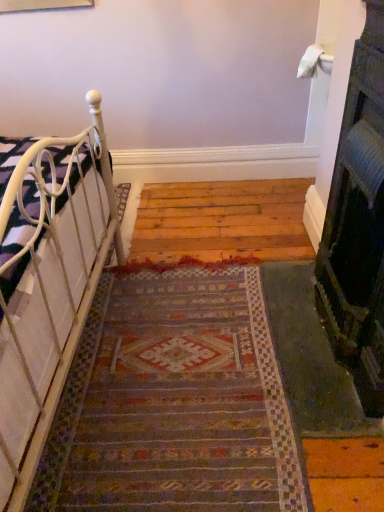
At what (x,y) coordinates should I click in order to perform the action: click on white metal bed at left. Please return your answer as a coordinate pair (x, y). The height and width of the screenshot is (512, 384). Looking at the image, I should click on (61, 271).

Where is `multicolored woven rug at center`? Image resolution: width=384 pixels, height=512 pixels. multicolored woven rug at center is located at coordinates pos(173,402).

Describe the element at coordinates (173, 402) in the screenshot. I see `multicolored woven rug at center` at that location.

The height and width of the screenshot is (512, 384). Identify the location of white metal bed at left. (61, 271).

From the image's perspective, which is below, white metal bed at left or multicolored woven rug at center?

multicolored woven rug at center, from the image's perspective.

Does white metal bed at left have a larger size compared to multicolored woven rug at center?

Indeed, white metal bed at left has a larger size compared to multicolored woven rug at center.

Considering the positions of objects white metal bed at left and multicolored woven rug at center in the image provided, who is more to the right, white metal bed at left or multicolored woven rug at center?

Positioned to the right is multicolored woven rug at center.

Measure the distance from white metal bed at left to multicolored woven rug at center.

white metal bed at left and multicolored woven rug at center are 16.73 inches apart.

Is black textured fireplace at right not inside multicolored woven rug at center?

Yes, black textured fireplace at right is outside of multicolored woven rug at center.

From a real-world perspective, which is physically above, black textured fireplace at right or multicolored woven rug at center?

black textured fireplace at right is physically above.

Would you consider black textured fireplace at right to be distant from multicolored woven rug at center?

No, black textured fireplace at right is not far away from multicolored woven rug at center.

Looking at this image, is black textured fireplace at right looking in the opposite direction of multicolored woven rug at center?

No.

Based on the photo, is multicolored woven rug at center far from black textured fireplace at right?

multicolored woven rug at center is actually quite close to black textured fireplace at right.

Choose the correct answer: Is multicolored woven rug at center inside black textured fireplace at right or outside it?

multicolored woven rug at center is outside black textured fireplace at right.

From a real-world perspective, who is located lower, multicolored woven rug at center or black textured fireplace at right?

From a 3D spatial view, multicolored woven rug at center is below.

Locate an element on the screen. The height and width of the screenshot is (512, 384). fireplace in front of the white metal bed at left is located at coordinates (358, 223).

Is black textured fireplace at right inside or outside of white metal bed at left?

black textured fireplace at right lies outside white metal bed at left.

Is the surface of black textured fireplace at right in direct contact with white metal bed at left?

black textured fireplace at right is not next to white metal bed at left, and they're not touching.

Is black textured fireplace at right to the left of white metal bed at left from the viewer's perspective?

No, black textured fireplace at right is not to the left of white metal bed at left.

Based on their sizes in the image, would you say white metal bed at left is bigger or smaller than black textured fireplace at right?

In the image, white metal bed at left appears to be larger than black textured fireplace at right.

Considering the positions of objects white metal bed at left and black textured fireplace at right in the image provided, who is behind, white metal bed at left or black textured fireplace at right?

white metal bed at left is behind.

From the image's perspective, is white metal bed at left located above black textured fireplace at right?

No, from the image's perspective, white metal bed at left is not over black textured fireplace at right.

Does multicolored woven rug at center turn towards white metal bed at left?

No.

Which of these two, multicolored woven rug at center or white metal bed at left, is smaller?

multicolored woven rug at center is smaller.

Between multicolored woven rug at center and white metal bed at left, which one appears on the left side from the viewer's perspective?

From the viewer's perspective, white metal bed at left appears more on the left side.

From a real-world perspective, which object stands above the other?

white metal bed at left.

Image resolution: width=384 pixels, height=512 pixels. In order to click on doormat to the right of white metal bed at left in this screenshot , I will do `click(173, 402)`.

You are a GUI agent. You are given a task and a screenshot of the screen. Output one action in this format:
    pyautogui.click(x=<x>, y=<y>)
    Task: Click on the doormat located underneath the black textured fireplace at right (from a real-world perspective)
    
    Given the screenshot: What is the action you would take?
    pyautogui.click(x=173, y=402)

Considering their positions, is black textured fireplace at right positioned closer to white metal bed at left than multicolored woven rug at center?

multicolored woven rug at center is positioned closer to the anchor white metal bed at left.

Estimate the real-world distances between objects in this image. Which object is further from white metal bed at left, multicolored woven rug at center or black textured fireplace at right?

The object further to white metal bed at left is black textured fireplace at right.

From the image, which object appears to be farther from multicolored woven rug at center, black textured fireplace at right or white metal bed at left?

black textured fireplace at right lies further to multicolored woven rug at center than the other object.

Based on their spatial positions, is white metal bed at left or multicolored woven rug at center further from black textured fireplace at right?

Among the two, white metal bed at left is located further to black textured fireplace at right.

Estimate the real-world distances between objects in this image. Which object is closer to multicolored woven rug at center, white metal bed at left or black textured fireplace at right?

Based on the image, white metal bed at left appears to be nearer to multicolored woven rug at center.

Considering their positions, is multicolored woven rug at center positioned closer to black textured fireplace at right than white metal bed at left?

Among the two, multicolored woven rug at center is located nearer to black textured fireplace at right.

Where is `doormat situated between white metal bed at left and black textured fireplace at right from left to right`? Image resolution: width=384 pixels, height=512 pixels. doormat situated between white metal bed at left and black textured fireplace at right from left to right is located at coordinates (173, 402).